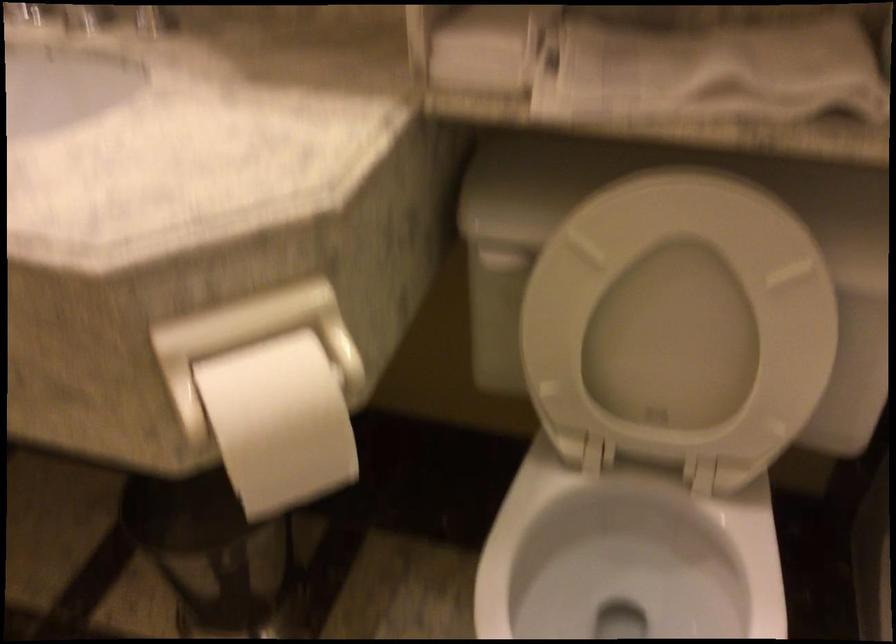
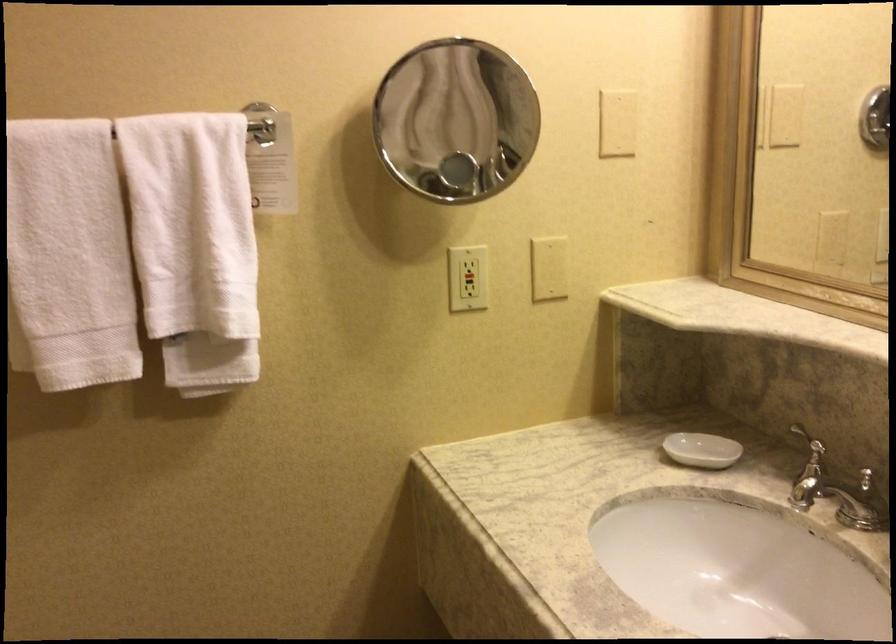
Question: The camera is either moving clockwise (left) or counter-clockwise (right) around the object. The first image is from the beginning of the video and the second image is from the end. Is the camera moving left or right when shooting the video?

Choices:
 (A) Left
 (B) Right

Answer: (B)